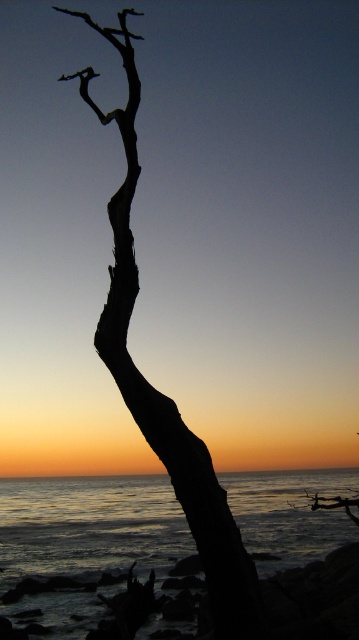
Which is above, silvery reflective water at lower center or black matte tree at center?

black matte tree at center is higher up.

Is silvery reflective water at lower center positioned in front of black matte tree at center?

No.

Who is more distant from viewer, (240, 500) or (185, 486)?

The point (240, 500) is behind.

At what (x,y) coordinates should I click in order to perform the action: click on silvery reflective water at lower center. Please return your answer as a coordinate pair (x, y). This screenshot has width=359, height=640. Looking at the image, I should click on [90, 525].